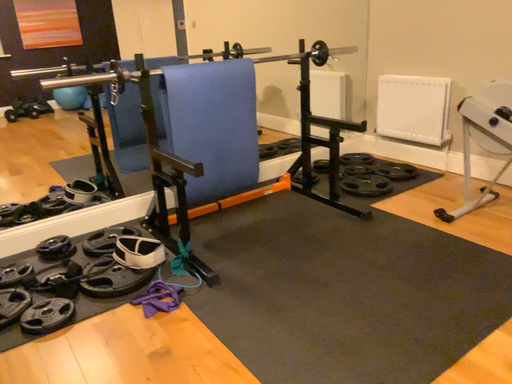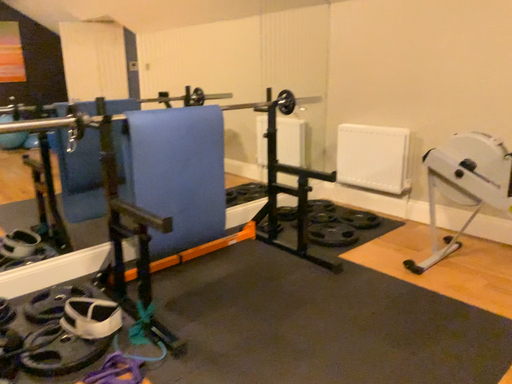
Question: Which way did the camera rotate in the video?

Choices:
 (A) rotated left
 (B) rotated right

Answer: (B)